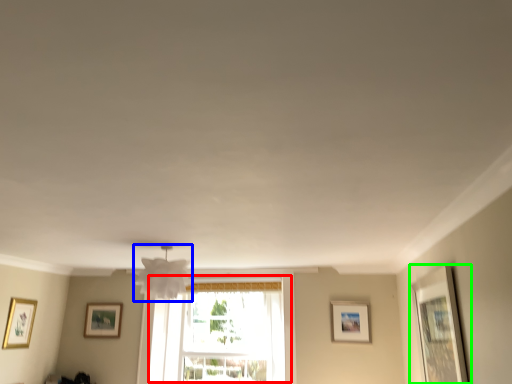
Question: Estimate the real-world distances between objects in this image. Which object is farther from window (highlighted by a red box), lamp (highlighted by a blue box) or picture frame (highlighted by a green box)?

Choices:
 (A) lamp
 (B) picture frame

Answer: (B)